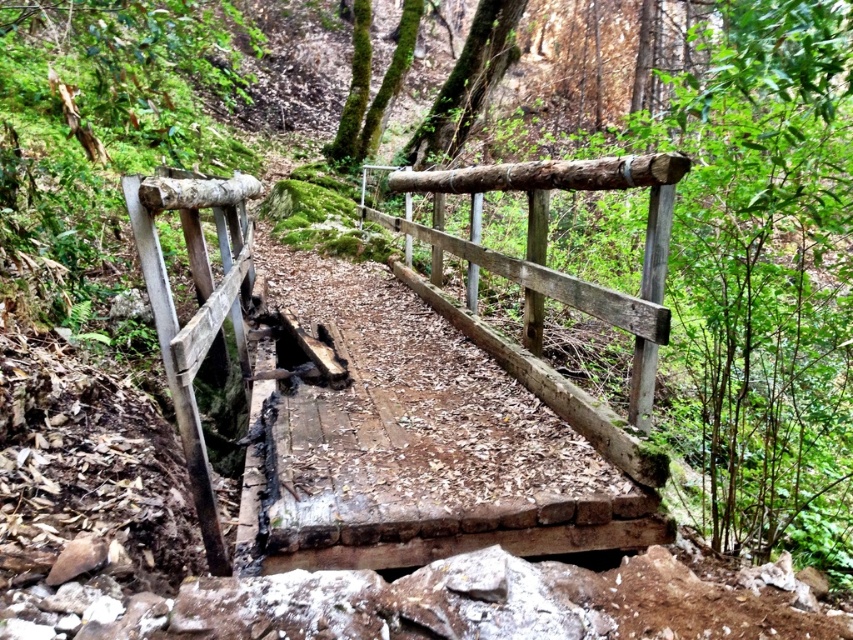
You are a hiker who wants to cross the weathered wood bridge at center. The bridge is at point (440, 440). Is the bridge safe to walk on?

The weathered wood bridge at center is located at point (440, 440). The bridge has missing or broken planks and exposed underlying structure, so it may not be safe to walk on.

You are a hiker carrying a backpack and want to cross the weathered wood bridge at center. Considering your height and the bridge structure, do you think you can safely walk under the bridge without hitting your head?

The weathered wood bridge at center is 1.90 meters away from viewer. Since the bridge is 1.90 meters high, and the average human height is around 1.70 meters, you should be able to walk under the bridge safely without hitting your head.

You are a hiker who wants to cross the weathered wood bridge at center. You notice the natural wood rail at center. Which object is closer to you as you approach the bridge?

The weathered wood bridge at center is closer to you than the natural wood rail at center as you approach the bridge.